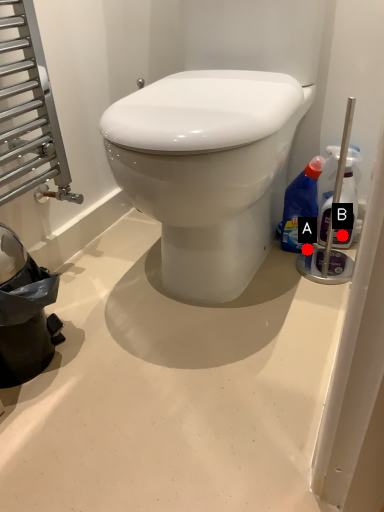
Question: Two points are circled on the image, labeled by A and B beside each circle. Among these points, which one is farthest from the camera?

Choices:
 (A) A is further
 (B) B is further

Answer: (A)